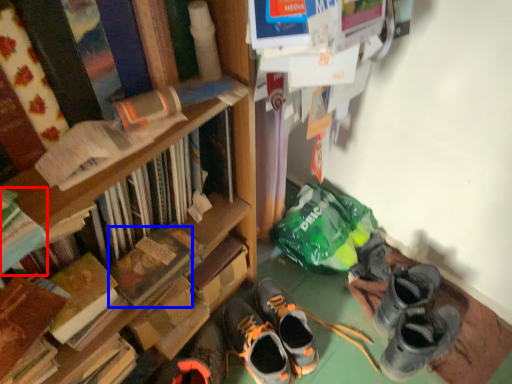
Question: Which object is further to the camera taking this photo, book (highlighted by a red box) or paperback book (highlighted by a blue box)?

Choices:
 (A) book
 (B) paperback book

Answer: (B)